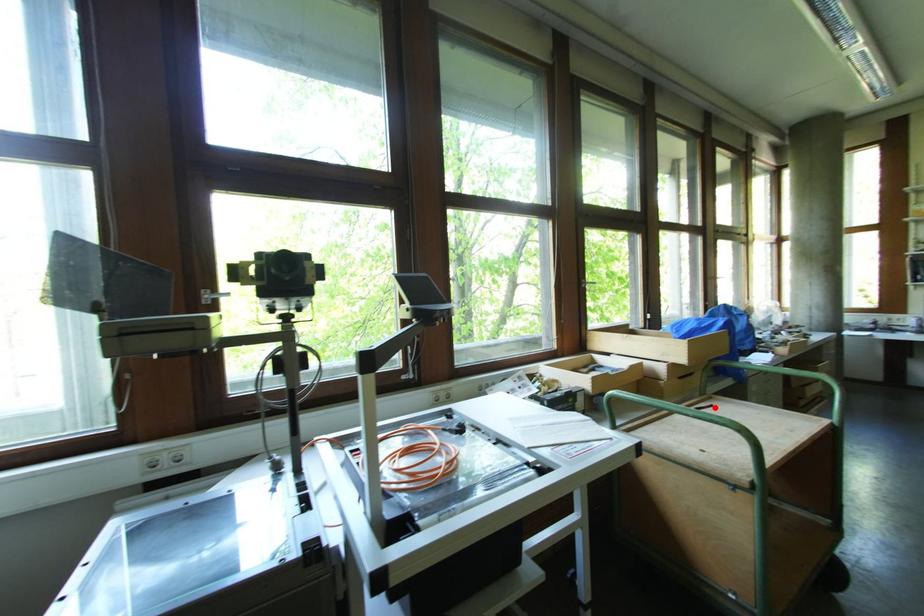
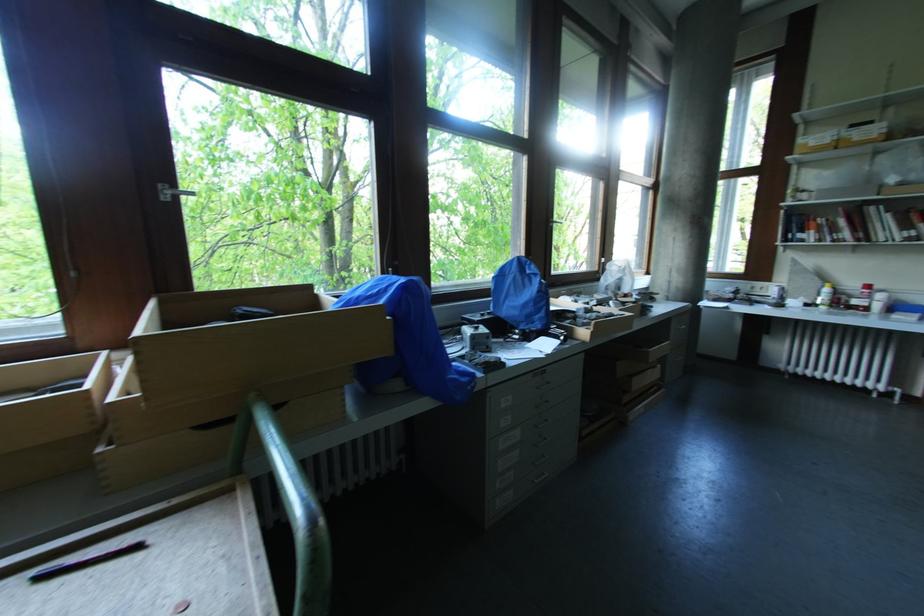
Find the pixel in the second image that matches the highlighted location in the first image.

(140, 549)